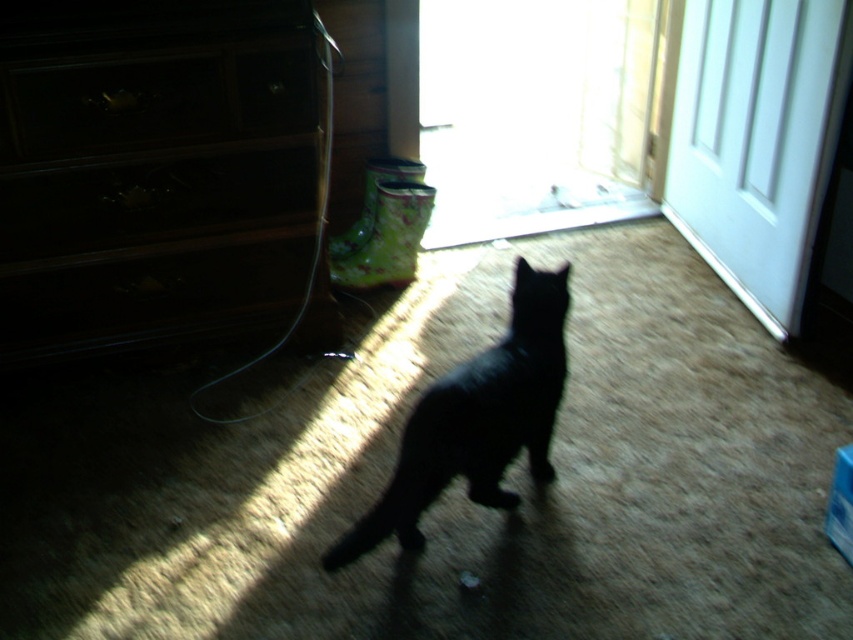
Question: Can you confirm if dark wood dresser at left is bigger than wooden drawer at left?

Choices:
 (A) yes
 (B) no

Answer: (A)

Question: Among these objects, which one is farthest from the camera?

Choices:
 (A) wooden drawer at left
 (B) white glossy door at upper right

Answer: (A)

Question: Which object appears farthest from the camera in this image?

Choices:
 (A) dark wood dresser at left
 (B) white glossy door at upper right

Answer: (B)

Question: Can you confirm if black matte cat at center is smaller than wooden drawer at left?

Choices:
 (A) no
 (B) yes

Answer: (A)

Question: Does black matte cat at center appear on the right side of wooden drawer at left?

Choices:
 (A) yes
 (B) no

Answer: (A)

Question: Which of these objects is positioned closest to the dark wood dresser at left?

Choices:
 (A) wooden drawer at left
 (B) white glossy door at upper right
 (C) black matte cat at center

Answer: (A)